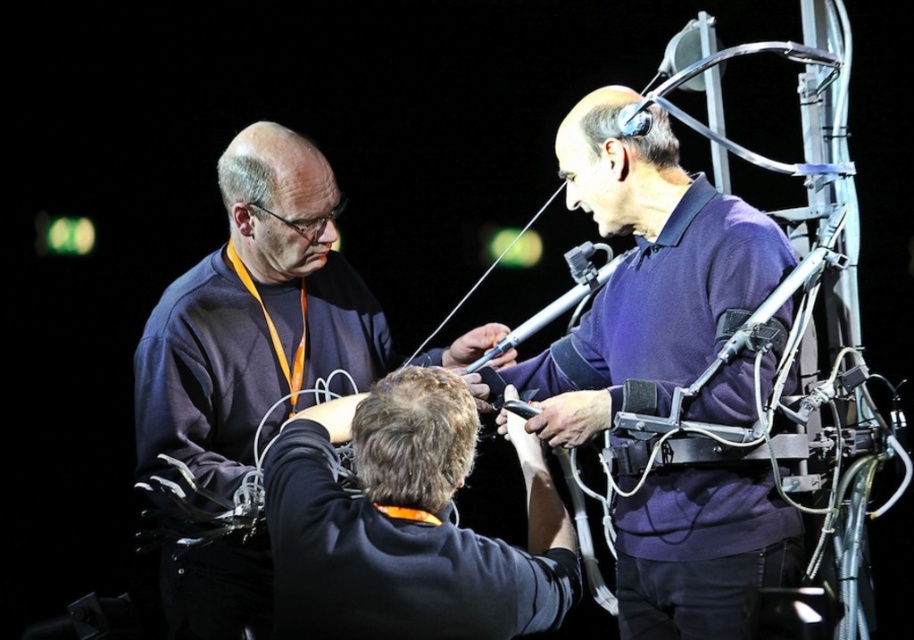
Is dark blue sweatshirt at center thinner than black matte jacket at center?

In fact, dark blue sweatshirt at center might be wider than black matte jacket at center.

Is dark blue sweatshirt at center wider than black matte jacket at center?

Correct, the width of dark blue sweatshirt at center exceeds that of black matte jacket at center.

Is point (363, 381) more distant than point (496, 586)?

Yes.

You are a GUI agent. You are given a task and a screenshot of the screen. Output one action in this format:
    pyautogui.click(x=<x>, y=<y>)
    Task: Click on the dark blue sweatshirt at center
    
    Given the screenshot: What is the action you would take?
    pyautogui.click(x=254, y=316)

Is purple matte shirt at center to the left of dark blue sweatshirt at center from the viewer's perspective?

In fact, purple matte shirt at center is to the right of dark blue sweatshirt at center.

Between purple matte shirt at center and dark blue sweatshirt at center, which one appears on the right side from the viewer's perspective?

Positioned to the right is purple matte shirt at center.

Between point (615, 556) and point (275, 371), which one is positioned behind?

Point (275, 371)

Locate an element on the screen. Image resolution: width=914 pixels, height=640 pixels. purple matte shirt at center is located at coordinates (645, 272).

Which is below, purple matte shirt at center or black matte jacket at center?

Positioned lower is black matte jacket at center.

Is point (758, 470) positioned in front of point (437, 589)?

No, (758, 470) is further to viewer.

Locate an element on the screen. purple matte shirt at center is located at coordinates click(x=645, y=272).